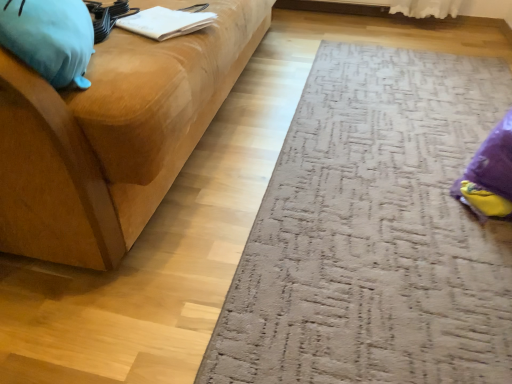
Question: From the image's perspective, is matte wood studio couch at left above or below textured gray doormat at lower right?

Choices:
 (A) below
 (B) above

Answer: (B)

Question: Would you say matte wood studio couch at left is to the left or to the right of textured gray doormat at lower right in the picture?

Choices:
 (A) right
 (B) left

Answer: (B)

Question: Based on their relative distances, which object is farther from the matte wood studio couch at left?

Choices:
 (A) textured gray doormat at lower right
 (B) soft blue plush at left
 (C) white paper at upper left

Answer: (A)

Question: Estimate the real-world distances between objects in this image. Which object is closer to the soft blue plush at left?

Choices:
 (A) matte wood studio couch at left
 (B) white paper at upper left
 (C) textured gray doormat at lower right

Answer: (A)